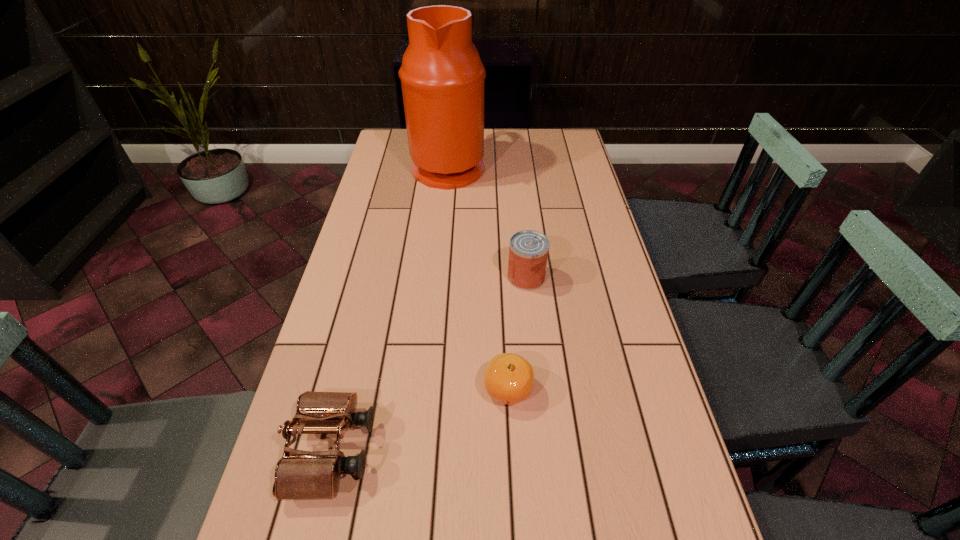
Find the location of a particular element. object that is at the far edge is located at coordinates (442, 77).

You are a GUI agent. You are given a task and a screenshot of the screen. Output one action in this format:
    pyautogui.click(x=<x>, y=<y>)
    Task: Click on the water jug located in the left edge section of the desktop
    This screenshot has width=960, height=540.
    Given the screenshot: What is the action you would take?
    pyautogui.click(x=442, y=77)

Where is `binoculars present at the left edge`? binoculars present at the left edge is located at coordinates (299, 474).

Locate an element on the screen. object that is at the far left corner is located at coordinates (442, 77).

What are the coordinates of `vacant space at the far edge of the desktop` in the screenshot? It's located at (492, 150).

Identify the location of free region at the left edge of the desktop. (354, 330).

What are the coordinates of `vacant area at the right edge` in the screenshot? It's located at (641, 376).

You are a GUI agent. You are given a task and a screenshot of the screen. Output one action in this format:
    pyautogui.click(x=<x>, y=<y>)
    Task: Click on the vacant area at the far left corner
    The width and height of the screenshot is (960, 540).
    Given the screenshot: What is the action you would take?
    pyautogui.click(x=391, y=140)

This screenshot has height=540, width=960. In the image, there is a desktop. In order to click on vacant space at the far right corner in this screenshot , I will do `click(576, 150)`.

You are a GUI agent. You are given a task and a screenshot of the screen. Output one action in this format:
    pyautogui.click(x=<x>, y=<y>)
    Task: Click on the vacant area that lies between the binoculars and the farthest object
    This screenshot has width=960, height=540.
    Given the screenshot: What is the action you would take?
    pyautogui.click(x=390, y=308)